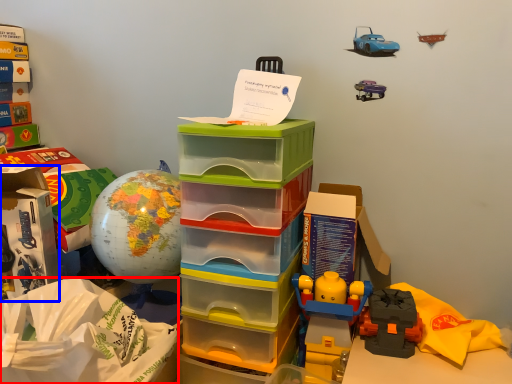
Question: Which point is further to the camera, paper bag (highlighted by a red box) or storage box (highlighted by a blue box)?

Choices:
 (A) paper bag
 (B) storage box

Answer: (B)